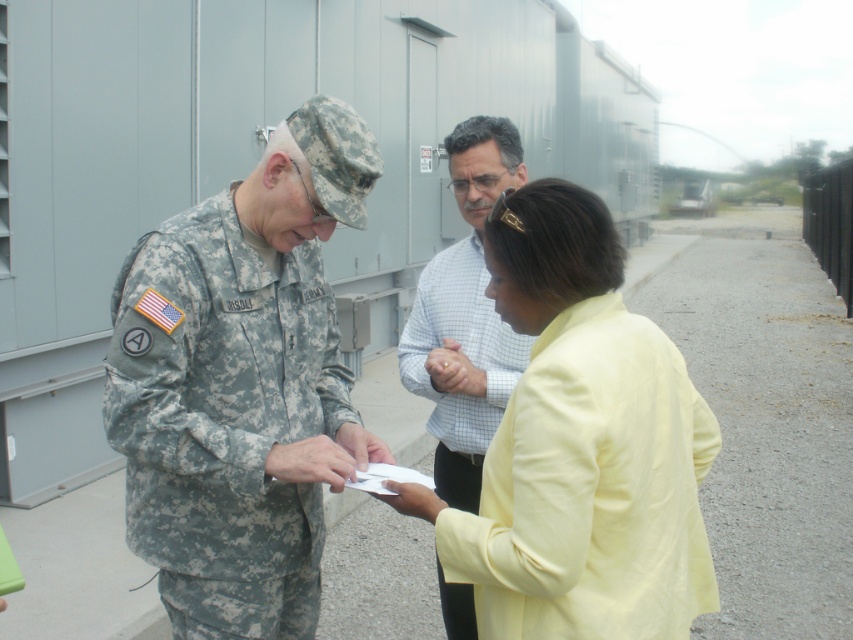
Question: Can you confirm if yellow fabric jacket at center is positioned to the right of light blue checkered shirt at center?

Choices:
 (A) no
 (B) yes

Answer: (B)

Question: Considering the real-world distances, which object is farthest from the yellow fabric jacket at center?

Choices:
 (A) light blue checkered shirt at center
 (B) camouflage fabric uniform at center

Answer: (A)

Question: Which of the following is the farthest from the observer?

Choices:
 (A) (492, 260)
 (B) (503, 182)

Answer: (B)

Question: Which of the following is the closest to the observer?

Choices:
 (A) (465, 458)
 (B) (128, 403)
 (C) (708, 596)

Answer: (C)

Question: Is yellow fabric jacket at center thinner than light blue checkered shirt at center?

Choices:
 (A) no
 (B) yes

Answer: (A)

Question: Is camouflage fabric uniform at center to the right of yellow fabric jacket at center from the viewer's perspective?

Choices:
 (A) yes
 (B) no

Answer: (B)